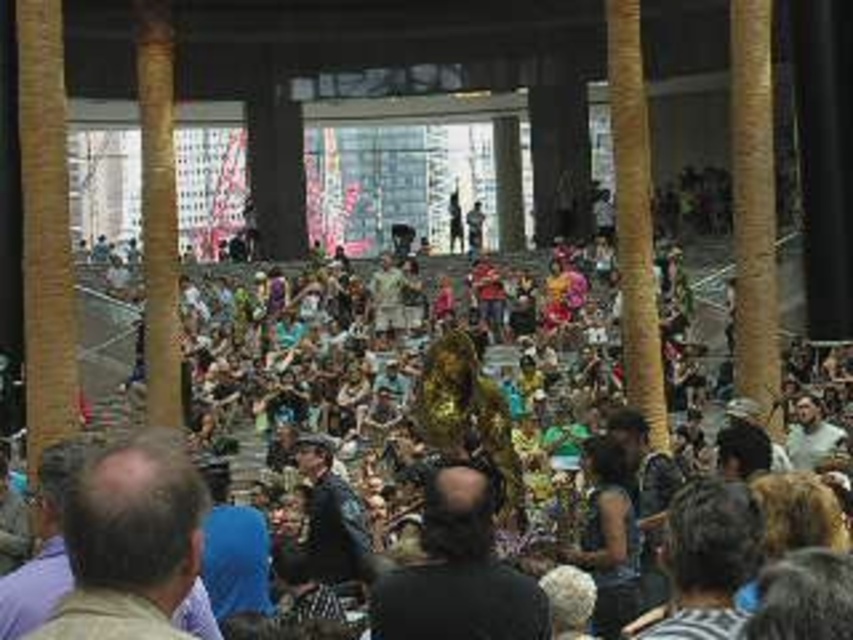
Question: Does multicolored fabric crowd at center come in front of brown hair at lower left?

Choices:
 (A) yes
 (B) no

Answer: (B)

Question: Is multicolored fabric crowd at center above brown hair at lower left?

Choices:
 (A) no
 (B) yes

Answer: (B)

Question: Can you confirm if multicolored fabric crowd at center is thinner than brown hair at lower left?

Choices:
 (A) yes
 (B) no

Answer: (B)

Question: Among these objects, which one is nearest to the camera?

Choices:
 (A) multicolored fabric crowd at center
 (B) brown hair at lower left

Answer: (B)